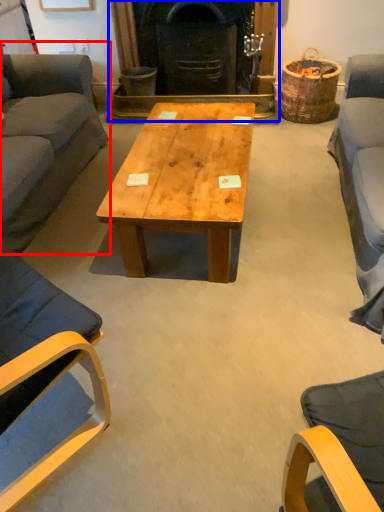
Question: Which point is closer to the camera, studio couch (highlighted by a red box) or fireplace (highlighted by a blue box)?

Choices:
 (A) studio couch
 (B) fireplace

Answer: (A)